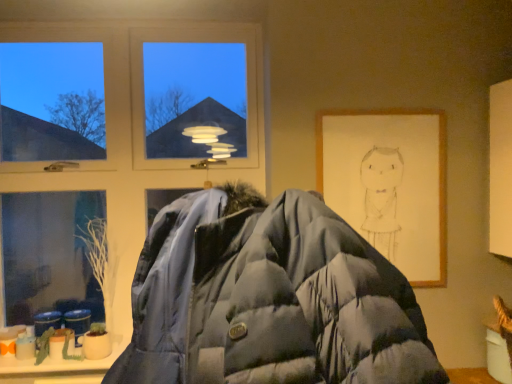
Question: Is wooden framed drawing at right positioned far away from matte blue puffer jacket at center?

Choices:
 (A) yes
 (B) no

Answer: (B)

Question: Is matte blue puffer jacket at center located within wooden framed drawing at right?

Choices:
 (A) yes
 (B) no

Answer: (B)

Question: From the image's perspective, is wooden framed drawing at right above matte blue puffer jacket at center?

Choices:
 (A) no
 (B) yes

Answer: (B)

Question: Is wooden framed drawing at right aimed at matte blue puffer jacket at center?

Choices:
 (A) yes
 (B) no

Answer: (B)

Question: From the image's perspective, would you say wooden framed drawing at right is shown under matte blue puffer jacket at center?

Choices:
 (A) yes
 (B) no

Answer: (B)

Question: From a real-world perspective, is wooden framed drawing at right beneath matte blue puffer jacket at center?

Choices:
 (A) yes
 (B) no

Answer: (B)

Question: Does matte blue puffer jacket at center appear on the left side of wooden framed drawing at right?

Choices:
 (A) yes
 (B) no

Answer: (A)

Question: Can you confirm if matte blue puffer jacket at center is wider than wooden framed drawing at right?

Choices:
 (A) no
 (B) yes

Answer: (B)

Question: Is matte blue puffer jacket at center placed right next to wooden framed drawing at right?

Choices:
 (A) yes
 (B) no

Answer: (B)

Question: Considering the relative sizes of matte blue puffer jacket at center and wooden framed drawing at right in the image provided, is matte blue puffer jacket at center shorter than wooden framed drawing at right?

Choices:
 (A) no
 (B) yes

Answer: (B)

Question: Is wooden framed drawing at right surrounded by matte blue puffer jacket at center?

Choices:
 (A) yes
 (B) no

Answer: (B)

Question: Would you consider matte blue puffer jacket at center to be distant from wooden framed drawing at right?

Choices:
 (A) yes
 (B) no

Answer: (B)

Question: Is wooden framed drawing at right to the right of transparent glass window at upper left from the viewer's perspective?

Choices:
 (A) yes
 (B) no

Answer: (A)